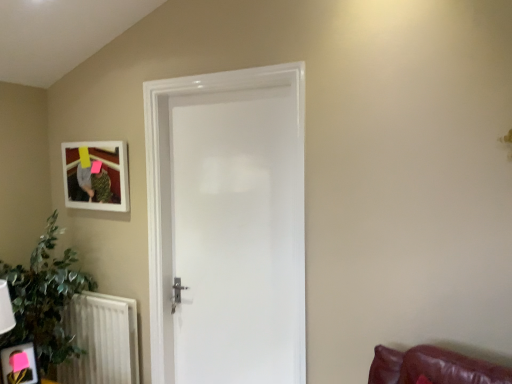
Question: In terms of height, does white textured radiator at lower left look taller or shorter compared to matte black picture frame at lower left, which is counted as the first picture frame, starting from the bottom?

Choices:
 (A) tall
 (B) short

Answer: (A)

Question: Visually, is white textured radiator at lower left positioned to the left or to the right of matte black picture frame at lower left, which is counted as the first picture frame, starting from the bottom?

Choices:
 (A) left
 (B) right

Answer: (B)

Question: Estimate the real-world distances between objects in this image. Which object is closer to the white matte picture frame at upper left, placed as the first picture frame when sorted from top to bottom?

Choices:
 (A) white textured radiator at lower left
 (B) white glossy door at center
 (C) green leafy plant at lower left
 (D) matte black picture frame at lower left, positioned as the first picture frame in front-to-back order

Answer: (C)

Question: Which of these objects is positioned farthest from the white glossy door at center?

Choices:
 (A) green leafy plant at lower left
 (B) matte black picture frame at lower left, which is the 2th picture frame in top-to-bottom order
 (C) white textured radiator at lower left
 (D) white matte picture frame at upper left, the first picture frame from the back

Answer: (B)